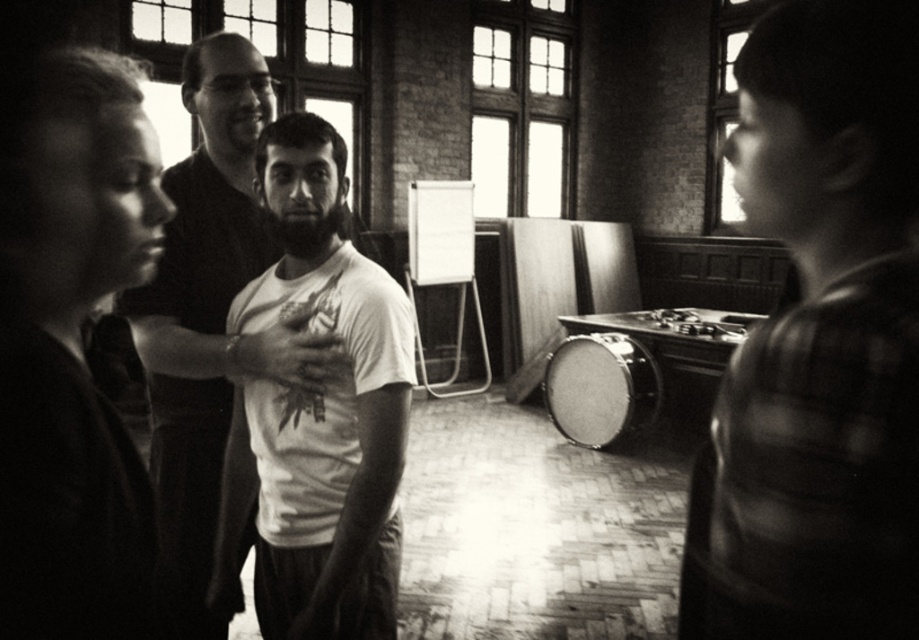
You are taking a photo of two points in a room with a camera that has a depth sensor. The points are labeled as point 1 at coordinates point (x=381, y=499) and point 2 at coordinates point (x=190, y=276). According to the image, which point is closer to the camera?

Point 1 at coordinates point (x=381, y=499) is closer to the camera than point 2 at coordinates point (x=190, y=276).